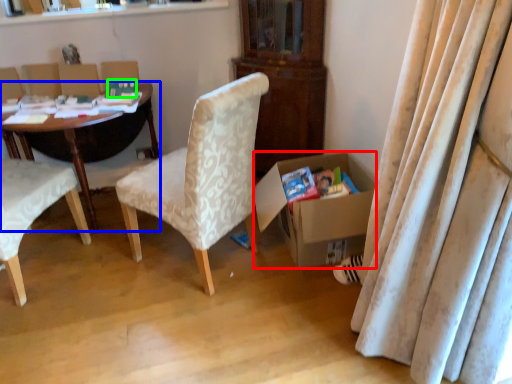
Question: Which object is positioned farthest from box (highlighted by a red box)? Select from desk (highlighted by a blue box) and paperback book (highlighted by a green box).

Choices:
 (A) desk
 (B) paperback book

Answer: (A)